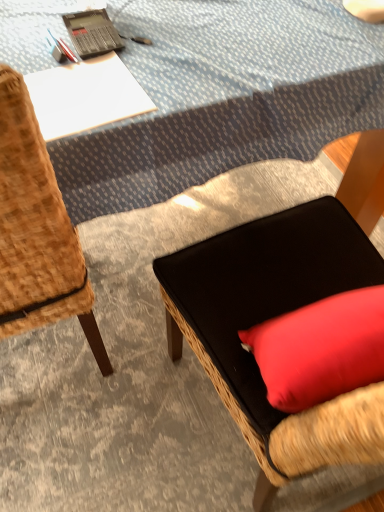
In order to click on free space behind black plastic calculator at upper left in this screenshot , I will do `click(115, 10)`.